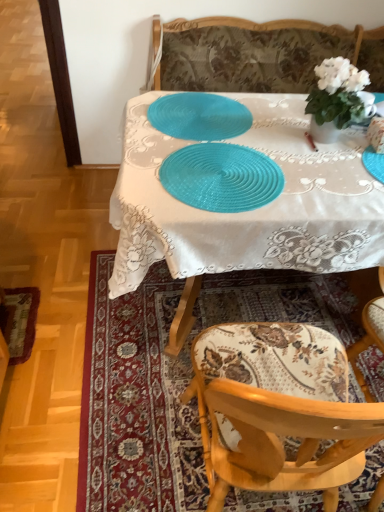
Where is `free space above teal plastic placemat at center, which ranks as the 2th tableware in bottom-to-top order (from a real-world perspective)`? free space above teal plastic placemat at center, which ranks as the 2th tableware in bottom-to-top order (from a real-world perspective) is located at coordinates (201, 110).